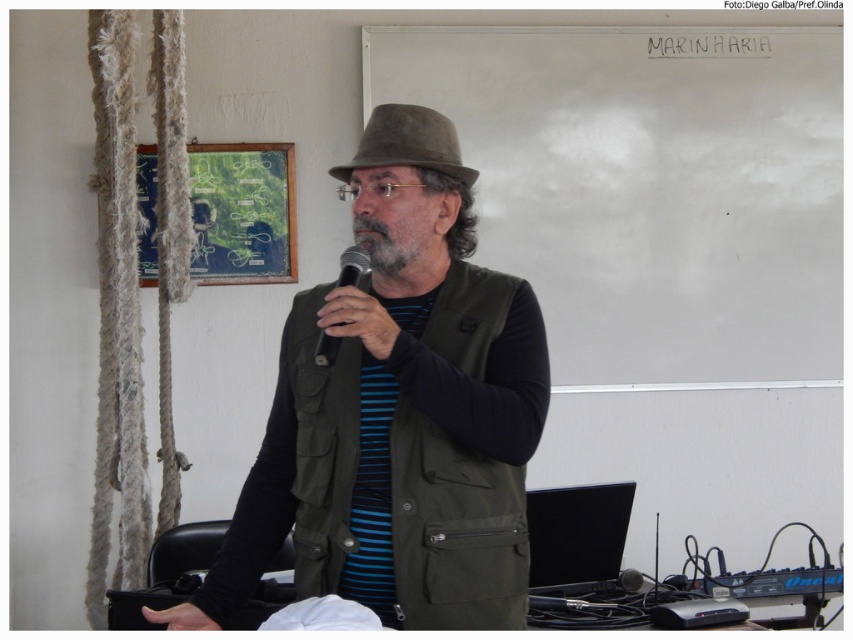
You are a photographer positioned in front of the scene. You want to focus on the point that is closer to you. Which point should you select between point (x=422, y=440) and point (x=316, y=349)?

Point (x=316, y=349) is closer to you than point (x=422, y=440), so you should select point (x=316, y=349).

Based on the scene description, can you determine if the brown felt fedora at upper center is wider than the gray matte beard at center?

The brown felt fedora at upper center might be wider than gray matte beard at center according to the description.